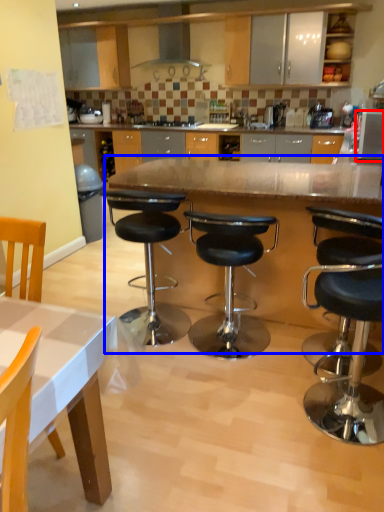
Question: Which object is closer to the camera taking this photo, appliance (highlighted by a red box) or table (highlighted by a blue box)?

Choices:
 (A) appliance
 (B) table

Answer: (B)